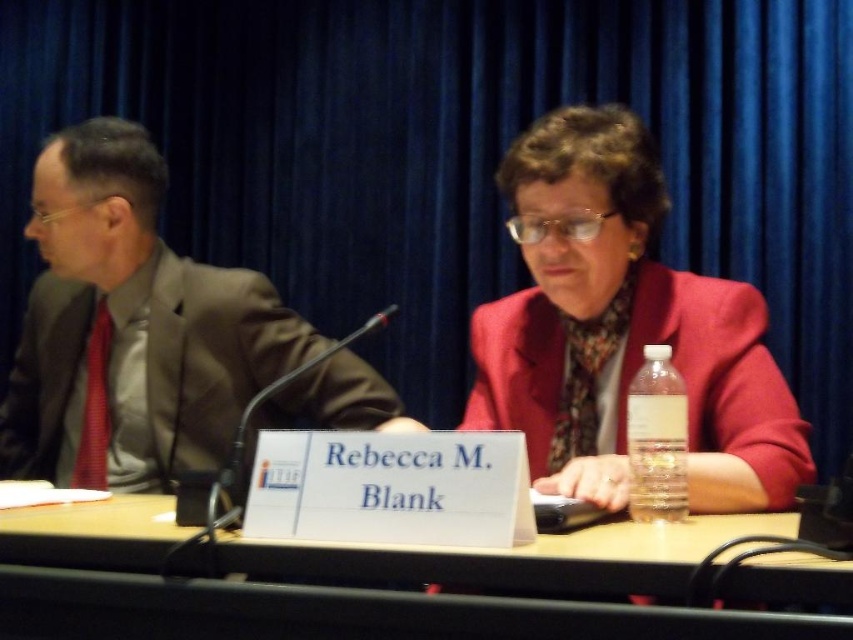
Question: Is matte brown suit at left behind wooden table at center?

Choices:
 (A) yes
 (B) no

Answer: (A)

Question: Is matte red blazer at center to the left of matte brown suit at left from the viewer's perspective?

Choices:
 (A) no
 (B) yes

Answer: (A)

Question: Which point is farther to the camera?

Choices:
 (A) (302, 321)
 (B) (611, 342)

Answer: (A)

Question: Which object appears closest to the camera in this image?

Choices:
 (A) matte red blazer at center
 (B) matte brown suit at left
 (C) wooden table at center

Answer: (C)

Question: Can you confirm if matte red blazer at center is wider than wooden table at center?

Choices:
 (A) yes
 (B) no

Answer: (B)

Question: Which is farther from the matte red blazer at center?

Choices:
 (A) wooden table at center
 (B) matte brown suit at left

Answer: (B)